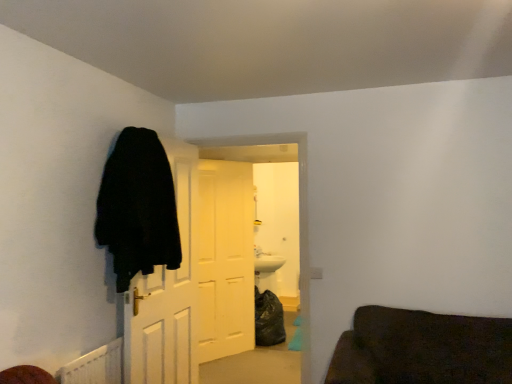
What is the approximate width of black matte door at left, the third door positioned from the back?

black matte door at left, the third door positioned from the back, is 4.88 inches wide.

The image size is (512, 384). What do you see at coordinates (225, 259) in the screenshot?
I see `white matte door at center, acting as the 1th door starting from the back` at bounding box center [225, 259].

At what (x,y) coordinates should I click in order to perform the action: click on black fuzzy coat at left. Please return your answer as a coordinate pair (x, y). The width and height of the screenshot is (512, 384). Looking at the image, I should click on (137, 207).

Is white matte door at center, marked as the 3th door in a front-to-back arrangement, surrounding white wooden door at center, which is the second door from back to front?

Actually, white wooden door at center, which is the second door from back to front, is outside white matte door at center, marked as the 3th door in a front-to-back arrangement.

Which door is the 1st one when counting from the left side of the white wooden door at center, which is counted as the second door, starting from the front? Please provide its 2D coordinates.

[(225, 259)]

Is white matte door at center, marked as the 3th door in a front-to-back arrangement, positioned behind white wooden door at center, which is counted as the second door, starting from the front?

Yes.

From a real-world perspective, does black fuzzy coat at left stand above white matte door at center, marked as the 3th door in a front-to-back arrangement?

Yes, from a real-world perspective, black fuzzy coat at left is over white matte door at center, marked as the 3th door in a front-to-back arrangement

Which of these two, black fuzzy coat at left or white matte door at center, acting as the 1th door starting from the back, is bigger?

Bigger between the two is white matte door at center, acting as the 1th door starting from the back.

Can you tell me how much black matte door at left, the 1th door in the front-to-back sequence, and white wooden door at center, which is counted as the second door, starting from the front, differ in facing direction?

The angular difference between black matte door at left, the 1th door in the front-to-back sequence, and white wooden door at center, which is counted as the second door, starting from the front, is 85.6 degrees.

Which is more to the left, black matte door at left, the third door positioned from the back, or white wooden door at center, which is the second door from back to front?

black matte door at left, the third door positioned from the back.

Can you confirm if black matte door at left, the third door positioned from the back, is shorter than white wooden door at center, which is the second door from back to front?

Yes, black matte door at left, the third door positioned from the back, is shorter than white wooden door at center, which is the second door from back to front.

Are black matte door at left, the third door positioned from the back, and white wooden door at center, which is counted as the second door, starting from the front, far apart?

Actually, black matte door at left, the third door positioned from the back, and white wooden door at center, which is counted as the second door, starting from the front, are a little close together.

Is point (166, 300) farther from viewer compared to point (104, 238)?

Yes, it is behind point (104, 238).

From a real-world perspective, is white wooden door at center, which is the second door from back to front, above or below black fuzzy coat at left?

white wooden door at center, which is the second door from back to front, is below black fuzzy coat at left.

Between white wooden door at center, which is counted as the second door, starting from the front, and black fuzzy coat at left, which one has larger size?

Bigger between the two is white wooden door at center, which is counted as the second door, starting from the front.

This screenshot has height=384, width=512. Find the location of `the 3rd door counting from the right side of the black fuzzy coat at left`. the 3rd door counting from the right side of the black fuzzy coat at left is located at coordinates (168, 293).

What are the coordinates of `cloak on the left side of white matte door at center, acting as the 1th door starting from the back` in the screenshot? It's located at (137, 207).

Does white matte door at center, marked as the 3th door in a front-to-back arrangement, lie behind black fuzzy coat at left?

Yes.

Measure the distance between white matte door at center, acting as the 1th door starting from the back, and black fuzzy coat at left.

white matte door at center, acting as the 1th door starting from the back, is 1.69 meters away from black fuzzy coat at left.

Which object is positioned more to the right, white matte door at center, acting as the 1th door starting from the back, or black fuzzy coat at left?

white matte door at center, acting as the 1th door starting from the back.

Is black fuzzy coat at left to the right of black matte door at left, the third door positioned from the back, from the viewer's perspective?

Incorrect, black fuzzy coat at left is not on the right side of black matte door at left, the third door positioned from the back.

Is black fuzzy coat at left looking in the opposite direction of black matte door at left, the third door positioned from the back?

Absolutely, black fuzzy coat at left is directed away from black matte door at left, the third door positioned from the back.

How distant is black fuzzy coat at left from black matte door at left, the third door positioned from the back?

black fuzzy coat at left and black matte door at left, the third door positioned from the back, are 39.83 centimeters apart.

Is white matte door at center, marked as the 3th door in a front-to-back arrangement, next to black matte door at left, the third door positioned from the back?

There is a gap between white matte door at center, marked as the 3th door in a front-to-back arrangement, and black matte door at left, the third door positioned from the back.

Considering the sizes of white matte door at center, marked as the 3th door in a front-to-back arrangement, and black matte door at left, the 1th door in the front-to-back sequence, in the image, is white matte door at center, marked as the 3th door in a front-to-back arrangement, wider or thinner than black matte door at left, the 1th door in the front-to-back sequence,?

white matte door at center, marked as the 3th door in a front-to-back arrangement, is wider than black matte door at left, the 1th door in the front-to-back sequence.

Is point (201, 193) positioned in front of point (149, 325)?

No, it is not.

At what (x,y) coordinates should I click in order to perform the action: click on door beneath the black matte door at left, the third door positioned from the back (from a real-world perspective). Please return your answer as a coordinate pair (x, y). This screenshot has height=384, width=512. Looking at the image, I should click on (225, 259).

You are a GUI agent. You are given a task and a screenshot of the screen. Output one action in this format:
    pyautogui.click(x=<x>, y=<y>)
    Task: Click on the door that is the 2nd object located below the white wooden door at center, which is the second door from back to front (from the image's perspective)
    The height and width of the screenshot is (384, 512).
    Given the screenshot: What is the action you would take?
    pos(225,259)

At what (x,y) coordinates should I click in order to perform the action: click on cloak above the white matte door at center, marked as the 3th door in a front-to-back arrangement (from the image's perspective). Please return your answer as a coordinate pair (x, y). Looking at the image, I should click on (137, 207).

Based on their spatial positions, is black fuzzy coat at left or black matte door at left, the third door positioned from the back, further from white matte door at center, marked as the 3th door in a front-to-back arrangement?

black fuzzy coat at left is positioned further to the anchor white matte door at center, marked as the 3th door in a front-to-back arrangement.

Considering their positions, is black matte door at left, the 1th door in the front-to-back sequence, positioned closer to black fuzzy coat at left than white wooden door at center, which is the second door from back to front?

Based on the image, black matte door at left, the 1th door in the front-to-back sequence, appears to be nearer to black fuzzy coat at left.

Based on their spatial positions, is black matte door at left, the 1th door in the front-to-back sequence, or white wooden door at center, which is the second door from back to front, further from white matte door at center, marked as the 3th door in a front-to-back arrangement?

black matte door at left, the 1th door in the front-to-back sequence, is further to white matte door at center, marked as the 3th door in a front-to-back arrangement.

Based on their spatial positions, is white matte door at center, acting as the 1th door starting from the back, or black fuzzy coat at left closer to white wooden door at center, which is counted as the second door, starting from the front?

black fuzzy coat at left is closer to white wooden door at center, which is counted as the second door, starting from the front.

Considering their positions, is white wooden door at center, which is the second door from back to front, positioned further to black matte door at left, the 1th door in the front-to-back sequence, than white matte door at center, marked as the 3th door in a front-to-back arrangement?

The object further to black matte door at left, the 1th door in the front-to-back sequence, is white matte door at center, marked as the 3th door in a front-to-back arrangement.

From the image, which object appears to be farther from black fuzzy coat at left, white wooden door at center, which is counted as the second door, starting from the front, or white matte door at center, acting as the 1th door starting from the back?

white matte door at center, acting as the 1th door starting from the back, is positioned further to the anchor black fuzzy coat at left.

When comparing their distances from black matte door at left, the 1th door in the front-to-back sequence, does black fuzzy coat at left or white wooden door at center, which is counted as the second door, starting from the front, seem closer?

white wooden door at center, which is counted as the second door, starting from the front.

Considering their positions, is white matte door at center, marked as the 3th door in a front-to-back arrangement, positioned closer to black fuzzy coat at left than white wooden door at center, which is the second door from back to front?

white wooden door at center, which is the second door from back to front, is positioned closer to the anchor black fuzzy coat at left.

The width and height of the screenshot is (512, 384). Identify the location of door located between black fuzzy coat at left and white wooden door at center, which is counted as the second door, starting from the front, in the depth direction. (167, 294).

Locate an element on the screen. The image size is (512, 384). door between black matte door at left, the third door positioned from the back, and white matte door at center, acting as the 1th door starting from the back, in the front-back direction is located at coordinates (168, 293).